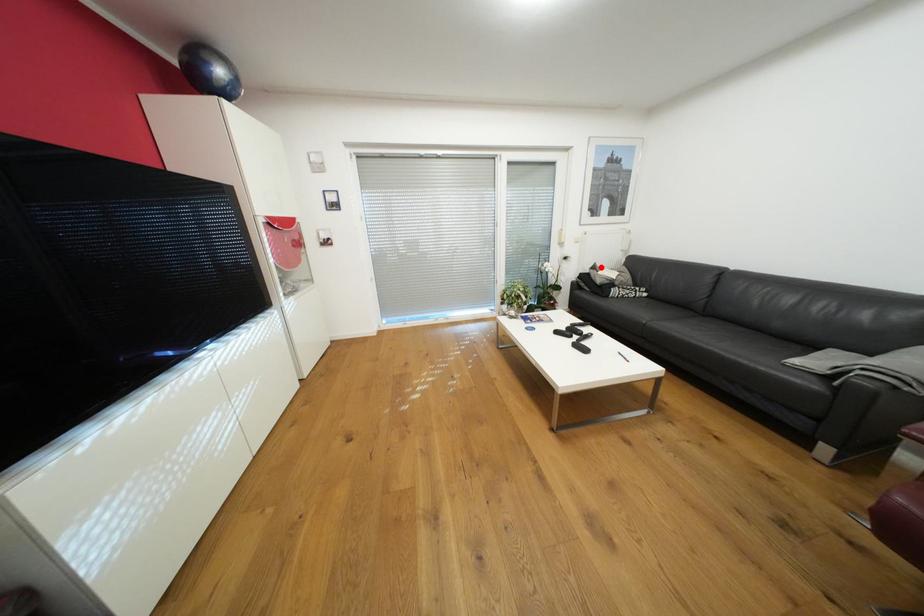
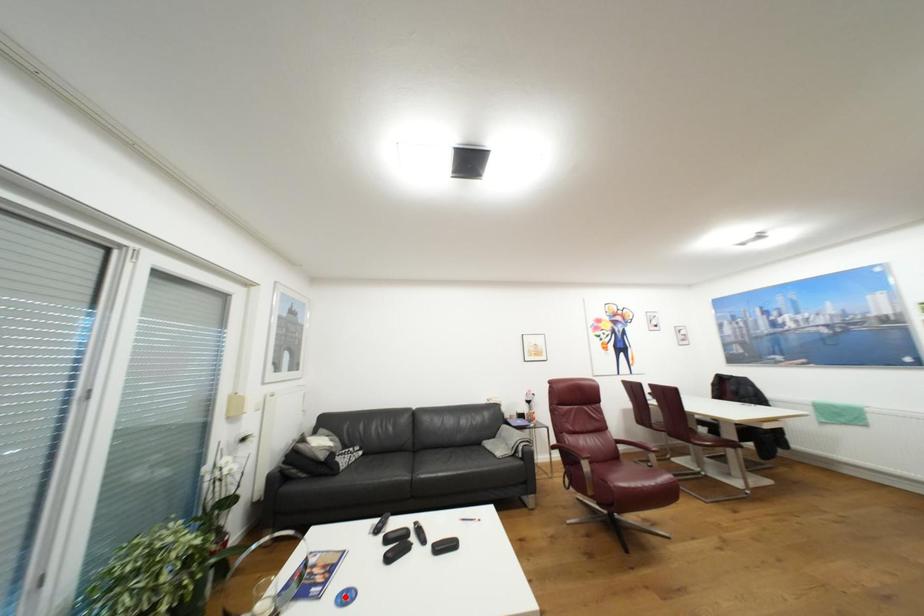
I am providing you with two images of the same scene from different viewpoints. A red point is marked on the first image and another point is marked on the second image. Do the highlighted points in image1 and image2 indicate the same real-world spot?

No